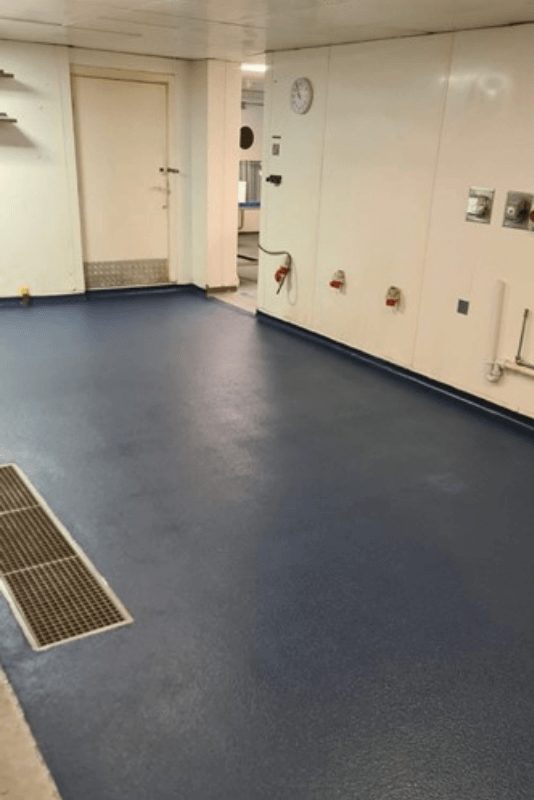
Identify the location of plates. This screenshot has height=800, width=534. (483, 193).